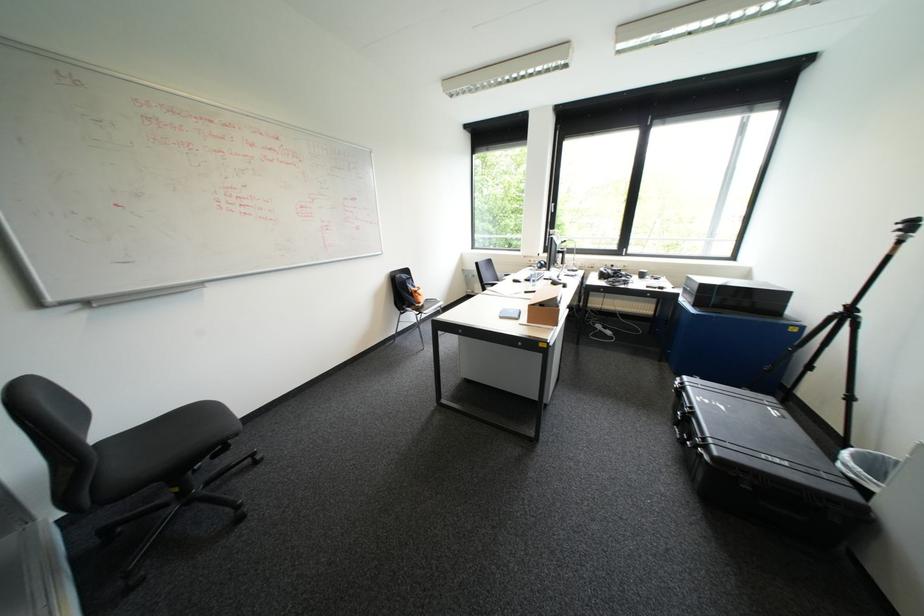
Which object does [544,306] point to?

It corresponds to the open cardboard box in the image.